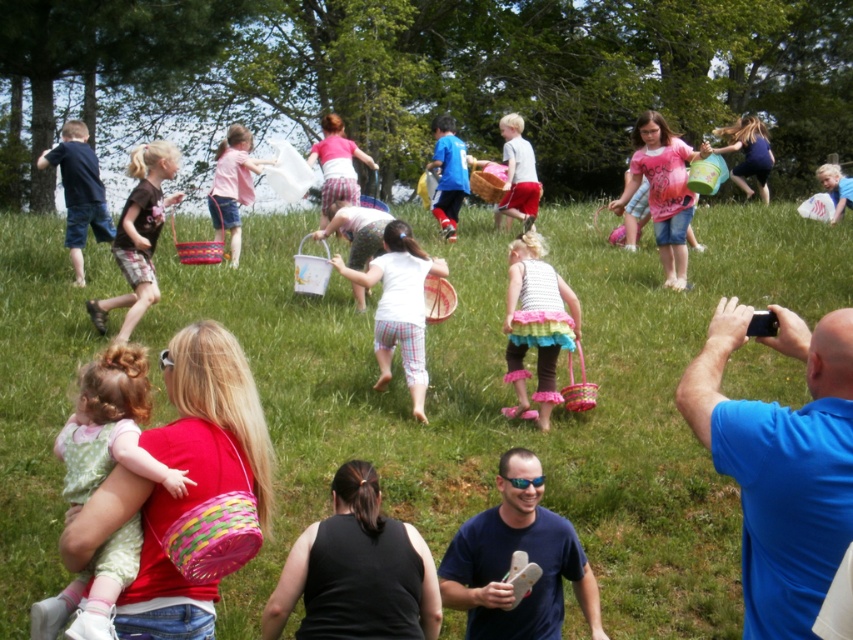
At what (x,y) coordinates should I click in order to perform the action: click on polka dot fabric baby at center. Please return your answer as a coordinate pair (x, y). The width and height of the screenshot is (853, 640). Looking at the image, I should click on [109, 426].

Who is taller, polka dot fabric baby at center or white cotton dress at center?

white cotton dress at center

At what (x,y) coordinates should I click in order to perform the action: click on polka dot fabric baby at center. Please return your answer as a coordinate pair (x, y). Looking at the image, I should click on (109, 426).

Is pink fabric dress at center further to the viewer compared to matte blue dress at upper right?

No, it is not.

Can you confirm if pink fabric dress at center is positioned to the right of matte blue dress at upper right?

In fact, pink fabric dress at center is to the left of matte blue dress at upper right.

This screenshot has height=640, width=853. What are the coordinates of `pink fabric dress at center` in the screenshot? It's located at (663, 189).

Between blue shirt at right and dark brown t-shirt at center, which one has less height?

dark brown t-shirt at center

Who is more distant from viewer, (815,499) or (138,300)?

The point (138,300) is more distant.

Locate an element on the screen. blue shirt at right is located at coordinates (781, 464).